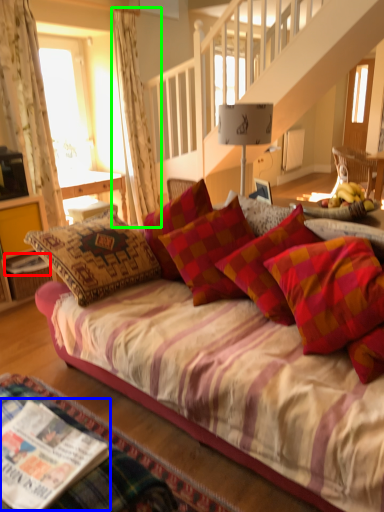
Question: Which is farther away from magazine (highlighted by a red box)? magazine (highlighted by a blue box) or curtain (highlighted by a green box)?

Choices:
 (A) magazine
 (B) curtain

Answer: (A)